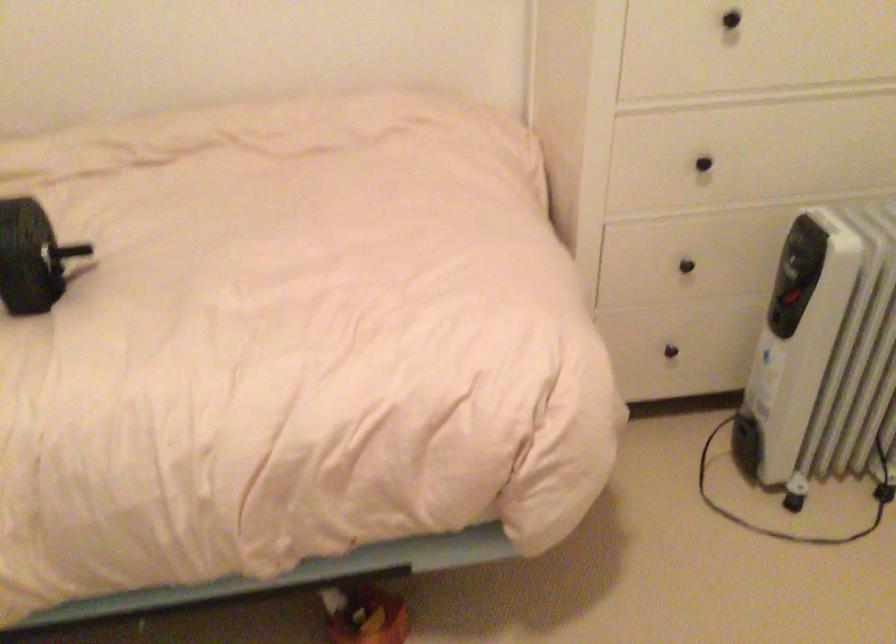
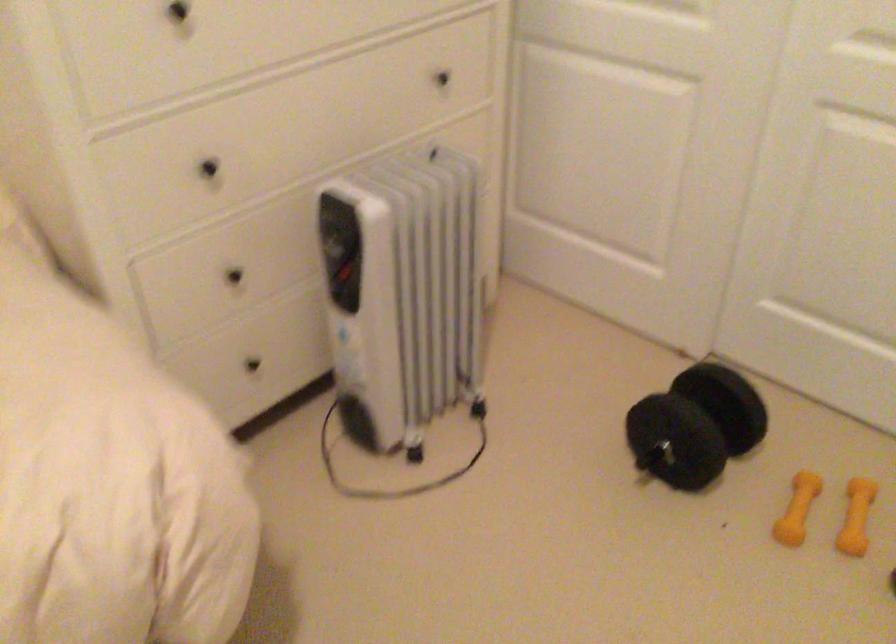
The point at (688,266) is marked in the first image. Where is the corresponding point in the second image?

(234, 276)